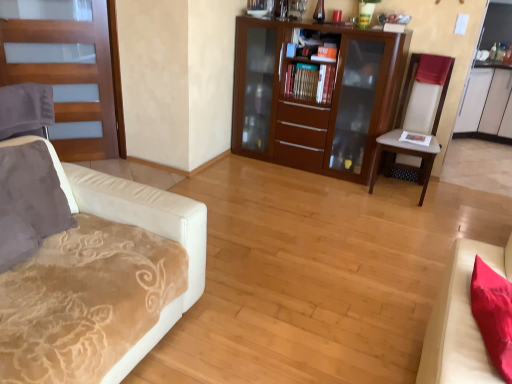
Question: Considering the positions of hardcover books at center and wooden door at left in the image, is hardcover books at center wider or thinner than wooden door at left?

Choices:
 (A) thin
 (B) wide

Answer: (B)

Question: From the image's perspective, is hardcover books at center above or below wooden door at left?

Choices:
 (A) below
 (B) above

Answer: (B)

Question: Which of these objects is positioned farthest from the wooden door at left?

Choices:
 (A) velvet beige couch at left, marked as the 2th studio couch in a right-to-left arrangement
 (B) beige fabric chair at right
 (C) hardcover books at center
 (D) wooden cabinet at center
 (E) suede-like gray pillow at left

Answer: (B)

Question: Which of these objects is positioned farthest from the hardcover books at center?

Choices:
 (A) wooden cabinet at center
 (B) velvet beige studio couch at lower right, the 2th studio couch when ordered from left to right
 (C) suede-like gray pillow at left
 (D) wooden door at left
 (E) beige fabric chair at right

Answer: (C)